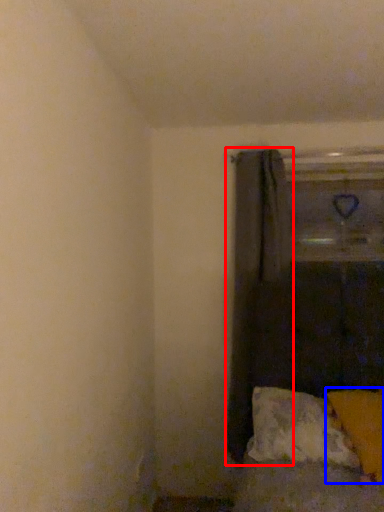
Question: Which of the following is the farthest to the observer, curtain (highlighted by a red box) or pillow (highlighted by a blue box)?

Choices:
 (A) curtain
 (B) pillow

Answer: (A)